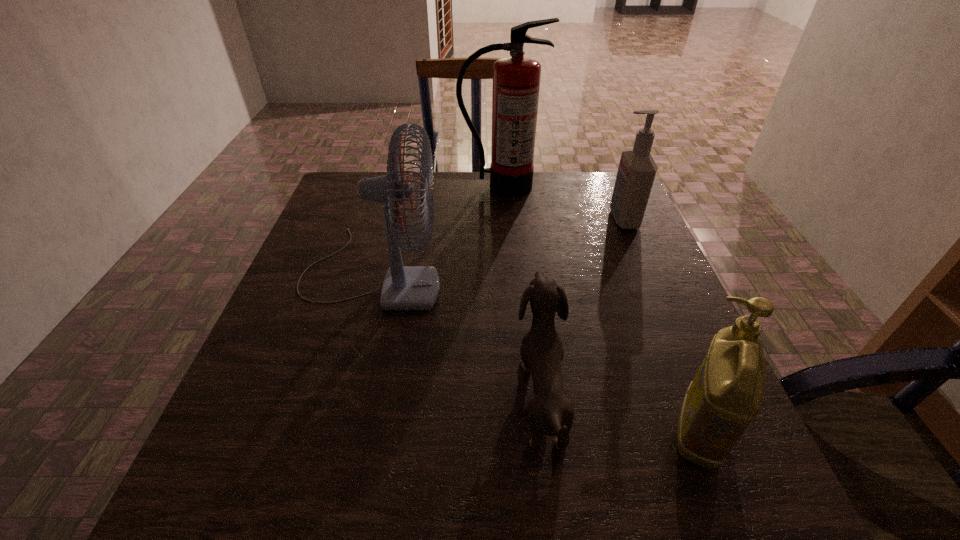
Identify the location of free space between the farthest object and the fourth tallest object. The height and width of the screenshot is (540, 960). (599, 309).

Locate an element on the screen. This screenshot has width=960, height=540. blank region between the cleansing agent and the shortest object is located at coordinates (582, 306).

Image resolution: width=960 pixels, height=540 pixels. In order to click on empty space between the fire extinguisher and the shortest object in this screenshot , I will do `click(521, 289)`.

Locate an element on the screen. free spot between the second shortest object and the puppy is located at coordinates (620, 412).

Locate an element on the screen. The image size is (960, 540). empty space that is in between the puppy and the cleansing agent is located at coordinates (582, 306).

In order to click on vacant space in between the cleansing agent and the leftmost object in this screenshot , I will do `click(497, 246)`.

The height and width of the screenshot is (540, 960). I want to click on vacant region between the shortest object and the detergent, so click(620, 412).

Identify which object is located as the nearest to the fourth shortest object. Please provide its 2D coordinates. Your answer should be formatted as a tuple, i.e. [(x, y)], where the tuple contains the x and y coordinates of a point satisfying the conditions above.

[(516, 79)]

Identify the location of the second closest object to the leftmost object. This screenshot has width=960, height=540. click(x=551, y=413).

Where is `free point that satisfies the following two spatial constraints: 1. at the face of the puppy; 2. on the back side of the detergent`? free point that satisfies the following two spatial constraints: 1. at the face of the puppy; 2. on the back side of the detergent is located at coordinates (546, 431).